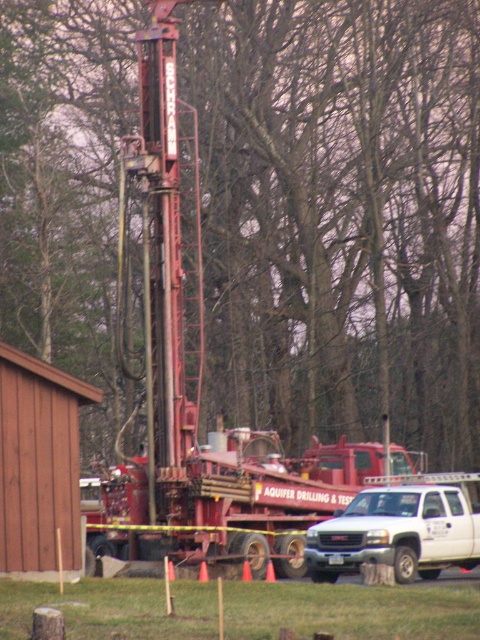
Can you confirm if bare branches at center is positioned below white matte truck at lower right?

No, bare branches at center is not below white matte truck at lower right.

Which is in front, point (380, 371) or point (433, 502)?

Point (433, 502) is in front.

What are the coordinates of `bare branches at center` in the screenshot? It's located at (340, 216).